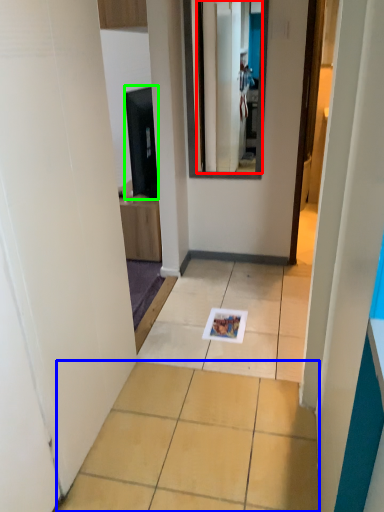
Question: Which object is positioned farthest from mirror (highlighted by a red box)? Select from ceramic tile (highlighted by a blue box) and appliance (highlighted by a green box).

Choices:
 (A) ceramic tile
 (B) appliance

Answer: (A)